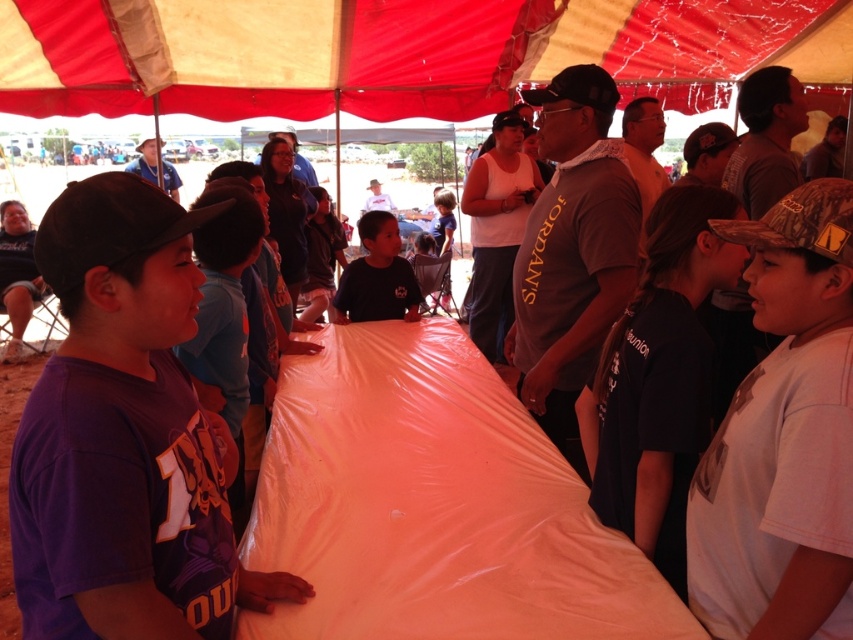
Who is more forward, (700, 3) or (370, 268)?

Point (370, 268) is more forward.

Does red fabric canopy at upper center have a greater height compared to dark blue shirt at center?

No, red fabric canopy at upper center is not taller than dark blue shirt at center.

Is point (532, 65) closer to viewer compared to point (375, 259)?

No.

Find the location of a particular element. red fabric canopy at upper center is located at coordinates (390, 52).